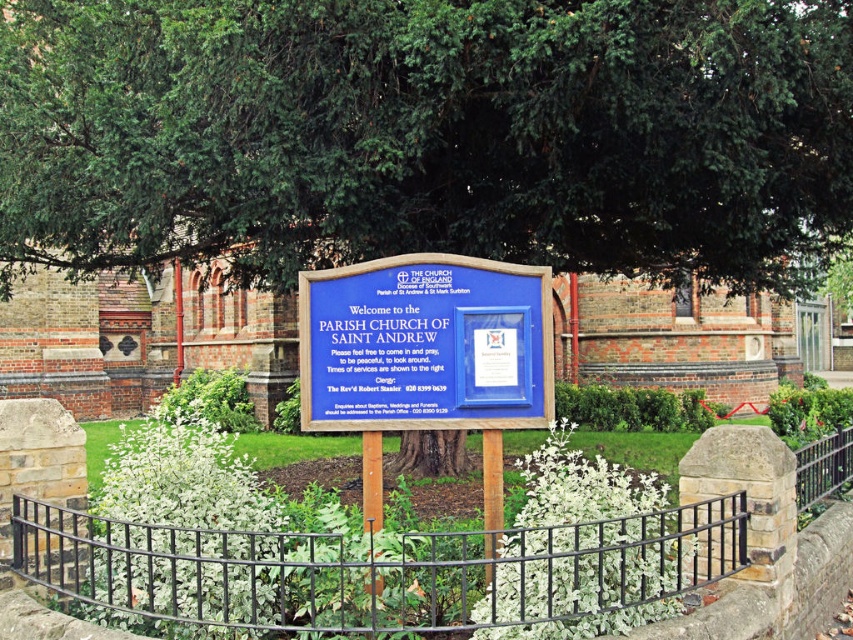
You are a visitor approaching the church entrance and see the green leafy tree at upper center and the black metal fence at center. Which object is taller?

The black metal fence at center is taller than the green leafy tree at upper center.

You are a delivery person with a cart that is 3 feet wide. You need to pass through the entrance area between the black metal fence at center and the blue wooden sign at center. Can your cart fit through the space between them?

The distance between the black metal fence at center and the blue wooden sign at center is 3.48 feet. Since your cart is 3 feet wide, it can fit through the space as there is enough clearance.

You are standing at the entrance of the Parish Church of Saint Andrew and notice two points marked on the ground. The first point is at coordinate point (434, 193), and the second is at coordinate point (486, 355). Which point is closer to you?

Point (434, 193) is further to the viewer than point (486, 355), so the point closer to you is point (486, 355).